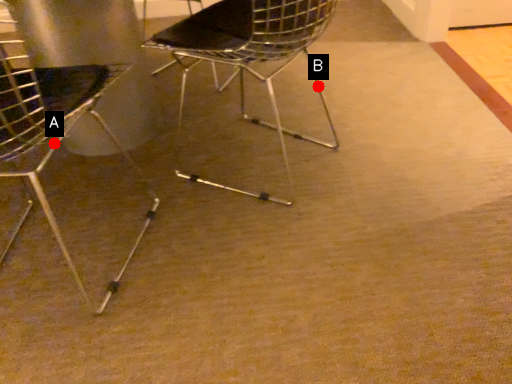
Question: Two points are circled on the image, labeled by A and B beside each circle. Which point is closer to the camera?

Choices:
 (A) A is closer
 (B) B is closer

Answer: (A)